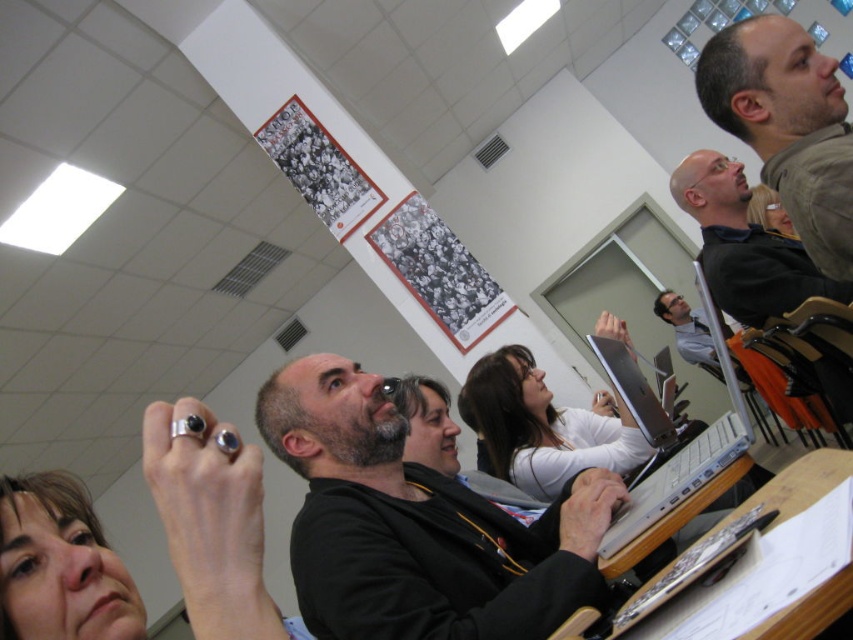
You are standing in the classroom and want to pick up the silver metallic ring at upper left located at point (210,524). Is there any object between you and the silver metallic ring at upper left that you need to avoid?

There is no object between you and the silver metallic ring at upper left located at point (210,524) according to the provided information.

Consider the image. You are a photographer standing in the room and want to take a photo of both the gray fabric shirt at upper right and the bald man at upper right without cropping either of them. What is the minimum distance you should keep between the camera and the subjects to ensure both fit in the frame?

The minimum distance should be at least 15.78 inches to ensure both the gray fabric shirt at upper right and the bald man at upper right fit in the frame without cropping.